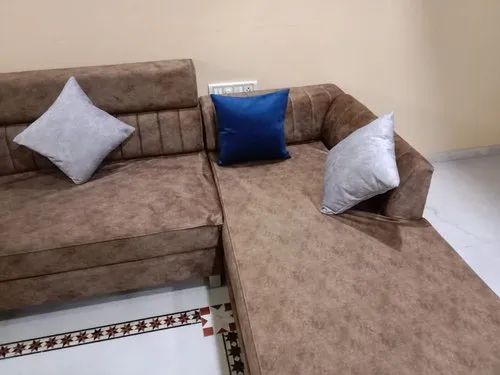
At what (x,y) coordinates should I click in order to perform the action: click on chaise part of couch. Please return your answer as a coordinate pair (x, y). The width and height of the screenshot is (500, 375). Looking at the image, I should click on (345, 281).